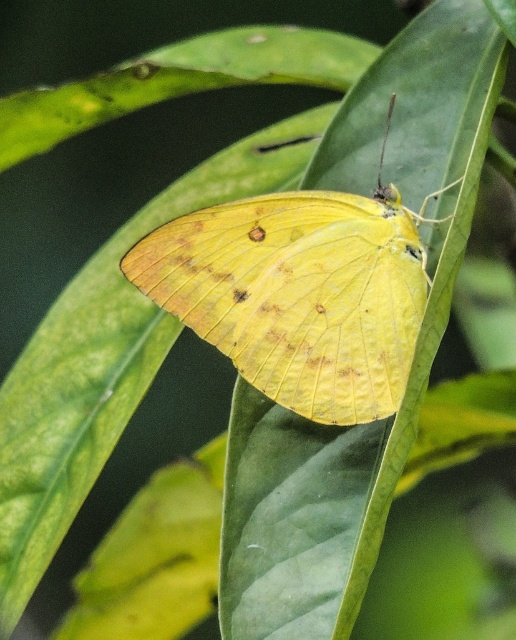
You are an entomologist observing the scene. You need to determine the relative widths of the green matte leaf at center and the yellow matte butterfly at center. Which object is narrower?

The green matte leaf at center is narrower than the yellow matte butterfly at center.

You are an entomologist observing the scene. You need to determine which object is bigger between the green matte leaf at center and the yellow matte butterfly at center. Which one is larger?

The green matte leaf at center is larger in size than the yellow matte butterfly at center according to the description.

You are an entomologist observing the green matte leaf at center and the yellow matte butterfly at center in the image. If you want to capture both in a single closeup photo without moving the camera, what should you consider about their distance?

The green matte leaf at center is 5.89 inches from the yellow matte butterfly at center, so you need to ensure the camera lens has a sufficient focal length to capture both within the frame without moving the camera.